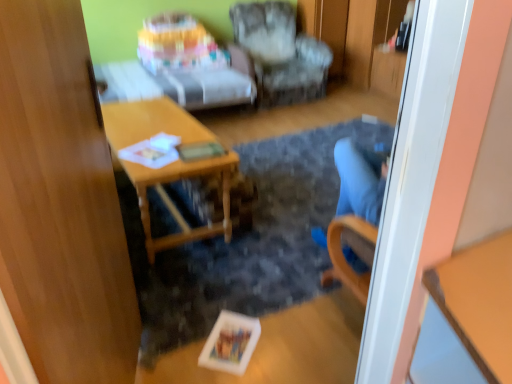
The height and width of the screenshot is (384, 512). Describe the element at coordinates (166, 165) in the screenshot. I see `wooden desk at center` at that location.

You are a GUI agent. You are given a task and a screenshot of the screen. Output one action in this format:
    pyautogui.click(x=<x>, y=<y>)
    Task: Click on the wooden desk at center
    The image size is (512, 384).
    Given the screenshot: What is the action you would take?
    pyautogui.click(x=166, y=165)

Where is `textured fabric armchair at center`? textured fabric armchair at center is located at coordinates (281, 53).

What do you see at coordinates (281, 53) in the screenshot?
I see `textured fabric armchair at center` at bounding box center [281, 53].

At what (x,y) coordinates should I click in order to perform the action: click on pastel fabric couch at upper center. Please return your answer as a coordinate pair (x, y). The image size is (512, 384). Looking at the image, I should click on (194, 63).

Describe the element at coordinates (61, 203) in the screenshot. The height and width of the screenshot is (384, 512). I see `transparent wood door at left` at that location.

Image resolution: width=512 pixels, height=384 pixels. I want to click on wooden desk at center, so click(x=166, y=165).

What's the angular difference between pastel fabric couch at upper center and textured fabric armchair at center's facing directions?

pastel fabric couch at upper center and textured fabric armchair at center are facing 8.58e-05 degrees away from each other.

Can you see pastel fabric couch at upper center touching textured fabric armchair at center?

No, pastel fabric couch at upper center is not in contact with textured fabric armchair at center.

From the image's perspective, would you say pastel fabric couch at upper center is shown under textured fabric armchair at center?

Yes.

Is pastel fabric couch at upper center bigger than textured fabric armchair at center?

No, pastel fabric couch at upper center is not bigger than textured fabric armchair at center.

How far apart are textured fabric armchair at center and pastel fabric couch at upper center?

textured fabric armchair at center is 59.78 centimeters from pastel fabric couch at upper center.

Considering the points (289, 44) and (170, 49), which point is behind, point (289, 44) or point (170, 49)?

The point (289, 44) is behind.

What's the angular difference between textured fabric armchair at center and pastel fabric couch at upper center's facing directions?

The angular difference between textured fabric armchair at center and pastel fabric couch at upper center is 8.58e-05 degrees.

From the image's perspective, between textured fabric armchair at center and pastel fabric couch at upper center, who is located below?

pastel fabric couch at upper center.

Considering the positions of objects wooden desk at center and textured fabric armchair at center in the image provided, who is in front, wooden desk at center or textured fabric armchair at center?

wooden desk at center.

Does point (146, 203) appear closer or farther from the camera than point (258, 24)?

Clearly, point (146, 203) is closer to the camera than point (258, 24).

Which object is wider, wooden desk at center or textured fabric armchair at center?

With larger width is textured fabric armchair at center.

Is textured fabric armchair at center to the right of transparent wood door at left from the viewer's perspective?

Correct, you'll find textured fabric armchair at center to the right of transparent wood door at left.

Between point (272, 89) and point (74, 159), which one is positioned in front?

The point (74, 159) is in front.

Considering the sizes of textured fabric armchair at center and transparent wood door at left in the image, is textured fabric armchair at center taller or shorter than transparent wood door at left?

textured fabric armchair at center is shorter than transparent wood door at left.

Does pastel fabric couch at upper center appear on the left side of transparent wood door at left?

Yes, pastel fabric couch at upper center is to the left of transparent wood door at left.

Considering the sizes of objects pastel fabric couch at upper center and transparent wood door at left in the image provided, who is shorter, pastel fabric couch at upper center or transparent wood door at left?

Standing shorter between the two is pastel fabric couch at upper center.

Is point (184, 84) closer to viewer compared to point (57, 76)?

No, it is behind (57, 76).

Locate an element on the screen. glass door in front of the pastel fabric couch at upper center is located at coordinates (61, 203).

Would you say wooden desk at center is to the left or to the right of transparent wood door at left in the picture?

In the image, wooden desk at center appears on the left side of transparent wood door at left.

From a real-world perspective, between wooden desk at center and transparent wood door at left, who is vertically higher?

In real-world perspective, transparent wood door at left is above.

Do you think wooden desk at center is within transparent wood door at left, or outside of it?

wooden desk at center is not enclosed by transparent wood door at left.

Is textured fabric armchair at center inside transparent wood door at left?

Actually, textured fabric armchair at center is outside transparent wood door at left.

Is point (33, 72) closer or farther from the camera than point (283, 5)?

Point (33, 72) is closer to the camera than point (283, 5).

Between transparent wood door at left and textured fabric armchair at center, which one has larger size?

Bigger between the two is textured fabric armchair at center.

The width and height of the screenshot is (512, 384). What are the coordinates of `chair that is behind the pastel fabric couch at upper center` in the screenshot? It's located at (281, 53).

Image resolution: width=512 pixels, height=384 pixels. What are the coordinates of `studio couch in front of the textured fabric armchair at center` in the screenshot? It's located at (194, 63).

Based on their spatial positions, is transparent wood door at left or textured fabric armchair at center further from wooden desk at center?

textured fabric armchair at center.

From the picture: When comparing their distances from pastel fabric couch at upper center, does transparent wood door at left or wooden desk at center seem further?

transparent wood door at left is positioned further to the anchor pastel fabric couch at upper center.

Considering their positions, is pastel fabric couch at upper center positioned further to wooden desk at center than transparent wood door at left?

pastel fabric couch at upper center is further to wooden desk at center.

Estimate the real-world distances between objects in this image. Which object is closer to transparent wood door at left, wooden desk at center or textured fabric armchair at center?

Based on the image, wooden desk at center appears to be nearer to transparent wood door at left.

From the image, which object appears to be nearer to textured fabric armchair at center, transparent wood door at left or pastel fabric couch at upper center?

pastel fabric couch at upper center lies closer to textured fabric armchair at center than the other object.

From the image, which object appears to be farther from textured fabric armchair at center, wooden desk at center or transparent wood door at left?

The object further to textured fabric armchair at center is transparent wood door at left.

Which object lies nearer to the anchor point transparent wood door at left, pastel fabric couch at upper center or wooden desk at center?

wooden desk at center lies closer to transparent wood door at left than the other object.

Looking at the image, which one is located further to transparent wood door at left, pastel fabric couch at upper center or textured fabric armchair at center?

textured fabric armchair at center is further to transparent wood door at left.

Locate an element on the screen. This screenshot has width=512, height=384. studio couch between transparent wood door at left and textured fabric armchair at center from front to back is located at coordinates (194, 63).

You are a GUI agent. You are given a task and a screenshot of the screen. Output one action in this format:
    pyautogui.click(x=<x>, y=<y>)
    Task: Click on the studio couch between wooden desk at center and textured fabric armchair at center from front to back
    This screenshot has height=384, width=512.
    Given the screenshot: What is the action you would take?
    pyautogui.click(x=194, y=63)

Find the location of a particular element. This screenshot has width=512, height=384. desk located between transparent wood door at left and pastel fabric couch at upper center in the depth direction is located at coordinates (166, 165).

Where is `desk between transparent wood door at left and textured fabric armchair at center along the z-axis`? The height and width of the screenshot is (384, 512). desk between transparent wood door at left and textured fabric armchair at center along the z-axis is located at coordinates (166, 165).